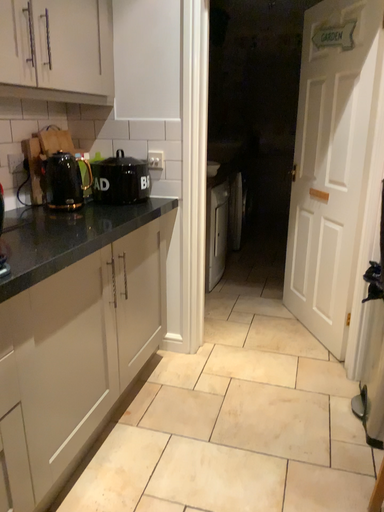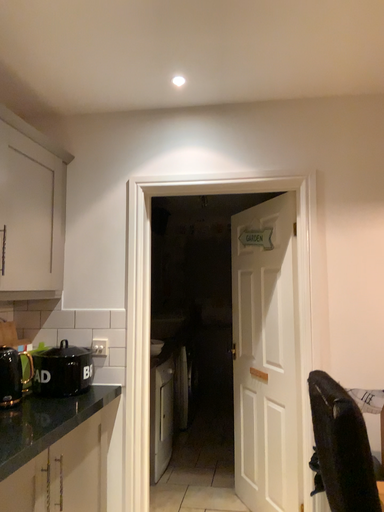
Question: Which way did the camera rotate in the video?

Choices:
 (A) rotated upward
 (B) rotated downward

Answer: (A)